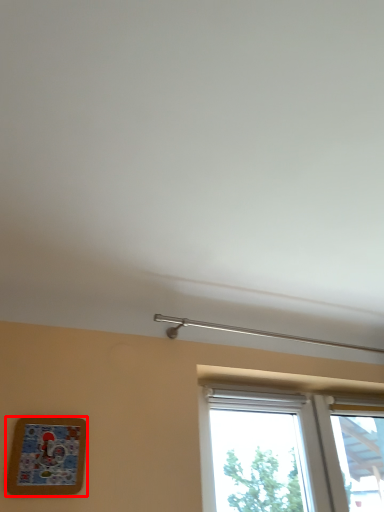
Question: Where is picture frame (annotated by the red box) located in relation to window in the image?

Choices:
 (A) right
 (B) left

Answer: (B)